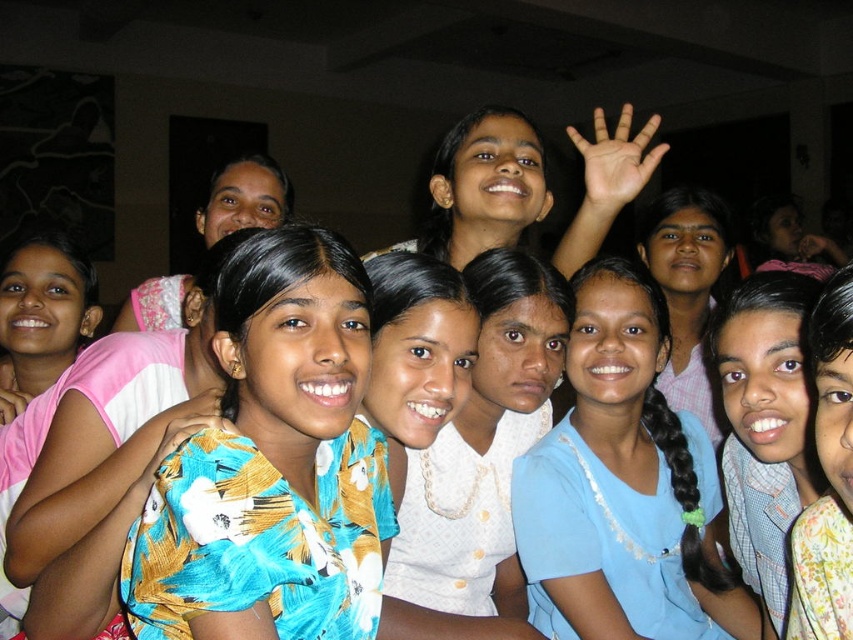
Looking at this image, is blue printed shirt at center closer to camera compared to matte yellow shirt at center?

Yes, blue printed shirt at center is closer to the viewer.

Who is more forward, [741,440] or [514,179]?

Point [741,440] is more forward.

Where is `blue printed shirt at center`? Image resolution: width=853 pixels, height=640 pixels. blue printed shirt at center is located at coordinates (764, 426).

Between point (560, 528) and point (206, 202), which one is positioned in front?

Point (560, 528) is in front.

Which is below, blue fabric at center or matte pink blouse at upper left?

blue fabric at center is lower down.

What do you see at coordinates (624, 486) in the screenshot?
I see `blue fabric at center` at bounding box center [624, 486].

Find the location of `blue fabric at center`. blue fabric at center is located at coordinates (624, 486).

Which of these two, matte yellow shirt at center or floral fabric shirt at center, stands shorter?

Standing shorter between the two is floral fabric shirt at center.

The height and width of the screenshot is (640, 853). Identify the location of matte yellow shirt at center. (490, 186).

Where is `matte yellow shirt at center`? matte yellow shirt at center is located at coordinates [490, 186].

Where is `matte yellow shirt at center`? matte yellow shirt at center is located at coordinates (490, 186).